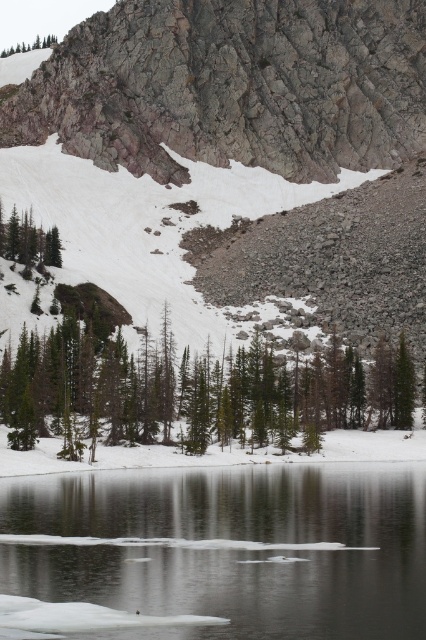
Question: Considering the relative positions of clear ice at lower center and green matte tree at lower left in the image provided, where is clear ice at lower center located with respect to green matte tree at lower left?

Choices:
 (A) below
 (B) above

Answer: (A)

Question: Estimate the real-world distances between objects in this image. Which object is farther from the green matte tree at lower left?

Choices:
 (A) green matte tree at upper left
 (B) green matte tree at center
 (C) clear ice at lower center

Answer: (A)

Question: Does green matte tree at center have a lesser width compared to green matte tree at upper left?

Choices:
 (A) no
 (B) yes

Answer: (B)

Question: Can you confirm if clear ice at lower center is bigger than green matte tree at center?

Choices:
 (A) yes
 (B) no

Answer: (B)

Question: Which of these objects is positioned closest to the green matte tree at center?

Choices:
 (A) green matte tree at upper left
 (B) clear ice at lower center
 (C) green matte tree at lower left

Answer: (C)

Question: Which object is closer to the camera taking this photo?

Choices:
 (A) green matte tree at center
 (B) green matte tree at lower left
 (C) green matte tree at upper left
 (D) clear ice at lower center

Answer: (D)